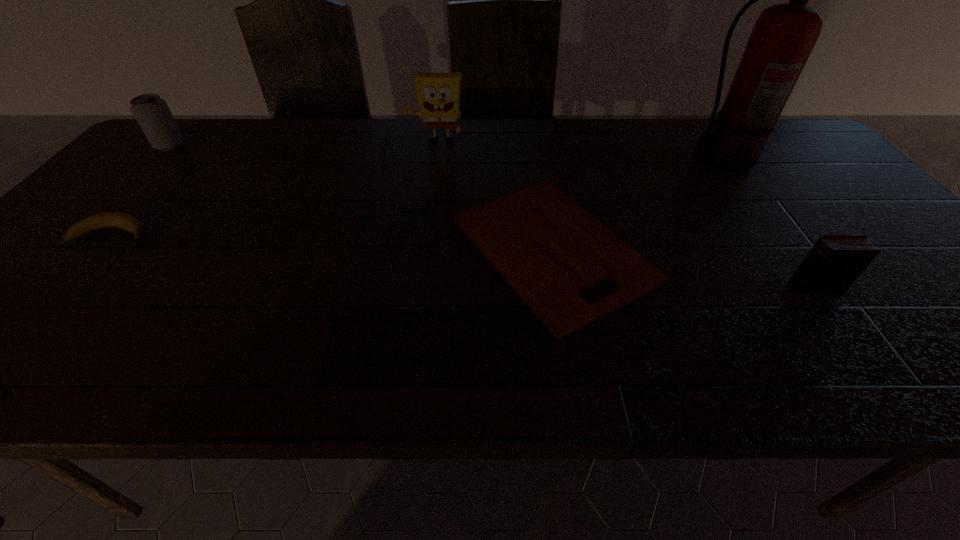
At what (x,y) coordinates should I click in order to perform the action: click on vacant space located 0.250m on the front of the can. Please return your answer as a coordinate pair (x, y). The height and width of the screenshot is (540, 960). Looking at the image, I should click on (113, 204).

You are a GUI agent. You are given a task and a screenshot of the screen. Output one action in this format:
    pyautogui.click(x=<x>, y=<y>)
    Task: Click on the free point located on the spine side of the diary
    
    Given the screenshot: What is the action you would take?
    pyautogui.click(x=767, y=286)

This screenshot has width=960, height=540. In order to click on vacant area situated 0.050m on the spine side of the diary in this screenshot , I will do `click(767, 286)`.

At what (x,y) coordinates should I click in order to perform the action: click on vacant space located 0.080m on the spine side of the diary. Please return your answer as a coordinate pair (x, y). The height and width of the screenshot is (540, 960). Looking at the image, I should click on click(x=753, y=286).

Where is `vacant space situated 0.390m at the stem of the fifth tallest object`? The width and height of the screenshot is (960, 540). vacant space situated 0.390m at the stem of the fifth tallest object is located at coordinates (316, 235).

Locate an element on the screen. vacant space located on the left of the chopping board is located at coordinates (350, 249).

Image resolution: width=960 pixels, height=540 pixels. I want to click on fire extinguisher present at the far edge, so click(x=784, y=35).

Find the location of a particular element. The width and height of the screenshot is (960, 540). sponge that is positioned at the far edge is located at coordinates (438, 93).

Image resolution: width=960 pixels, height=540 pixels. What are the coordinates of `can located at the far edge` in the screenshot? It's located at (152, 113).

You are a GUI agent. You are given a task and a screenshot of the screen. Output one action in this format:
    pyautogui.click(x=<x>, y=<y>)
    Task: Click on the can at the left edge
    
    Given the screenshot: What is the action you would take?
    pyautogui.click(x=152, y=113)